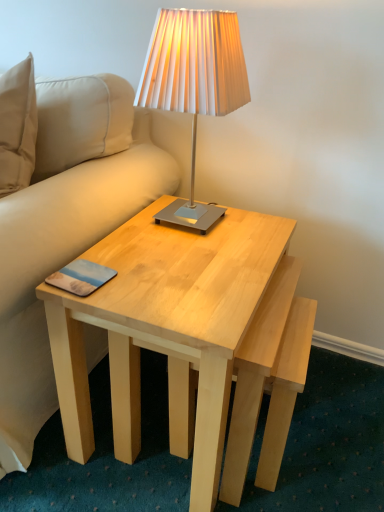
Question: Is matte silver lamp at upper center a part of light wood coffee table at center?

Choices:
 (A) yes
 (B) no

Answer: (B)

Question: Is light wood coffee table at center at the right side of matte silver lamp at upper center?

Choices:
 (A) yes
 (B) no

Answer: (B)

Question: From a real-world perspective, is light wood coffee table at center positioned under matte silver lamp at upper center based on gravity?

Choices:
 (A) no
 (B) yes

Answer: (B)

Question: Does light wood coffee table at center have a smaller size compared to matte silver lamp at upper center?

Choices:
 (A) no
 (B) yes

Answer: (A)

Question: Is light wood coffee table at center behind matte silver lamp at upper center?

Choices:
 (A) no
 (B) yes

Answer: (A)

Question: Is matte silver lamp at upper center bigger or smaller than light wood coffee table at center?

Choices:
 (A) small
 (B) big

Answer: (A)

Question: From the image's perspective, relative to light wood coffee table at center, is matte silver lamp at upper center above or below?

Choices:
 (A) below
 (B) above

Answer: (B)

Question: In the image, is matte silver lamp at upper center on the left side or the right side of light wood coffee table at center?

Choices:
 (A) right
 (B) left

Answer: (A)

Question: Is point (185, 99) positioned closer to the camera than point (243, 271)?

Choices:
 (A) closer
 (B) farther

Answer: (A)

Question: Is point (74, 265) positioned closer to the camera than point (147, 305)?

Choices:
 (A) closer
 (B) farther

Answer: (B)

Question: From the image's perspective, is matte plastic pad at lower left located above or below light wood coffee table at center?

Choices:
 (A) below
 (B) above

Answer: (B)

Question: Considering the relative positions of matte plastic pad at lower left and light wood coffee table at center in the image provided, is matte plastic pad at lower left to the left or to the right of light wood coffee table at center?

Choices:
 (A) right
 (B) left

Answer: (B)

Question: From a real-world perspective, is matte plastic pad at lower left above or below light wood coffee table at center?

Choices:
 (A) above
 (B) below

Answer: (A)

Question: Which is correct: matte silver lamp at upper center is inside matte plastic pad at lower left, or outside of it?

Choices:
 (A) outside
 (B) inside

Answer: (A)

Question: From the image's perspective, is matte silver lamp at upper center positioned above or below matte plastic pad at lower left?

Choices:
 (A) above
 (B) below

Answer: (A)